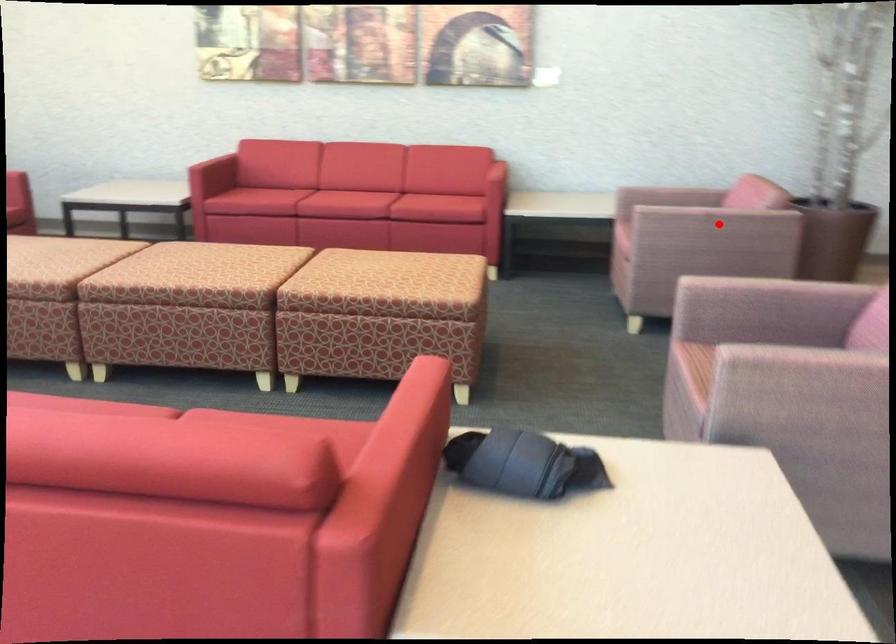
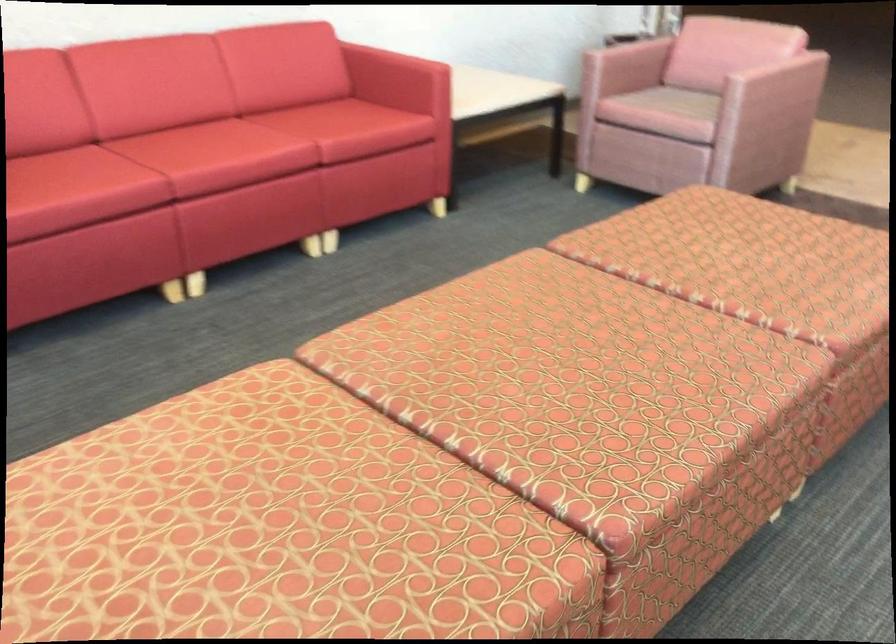
Question: I am providing you with two images of the same scene from different viewpoints. Image1 has a red point marked. In image2, the corresponding 3D location appears at what relative position? Reply with the corresponding letter.

Choices:
 (A) Closer
 (B) Farther

Answer: (A)